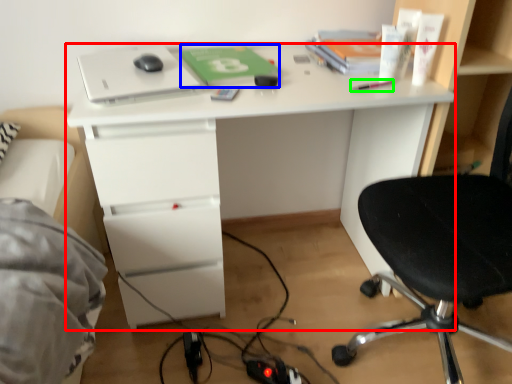
Question: Estimate the real-world distances between objects in this image. Which object is closer to desk (highlighted by a red box), paperback book (highlighted by a blue box) or stationery (highlighted by a green box)?

Choices:
 (A) paperback book
 (B) stationery

Answer: (A)